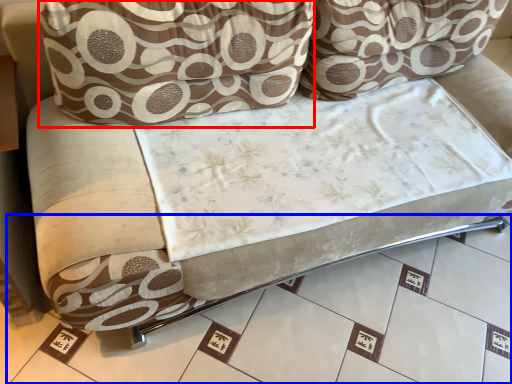
Question: Which of the following is the closest to the observer, throw pillow (highlighted by a red box) or tile (highlighted by a blue box)?

Choices:
 (A) throw pillow
 (B) tile

Answer: (B)